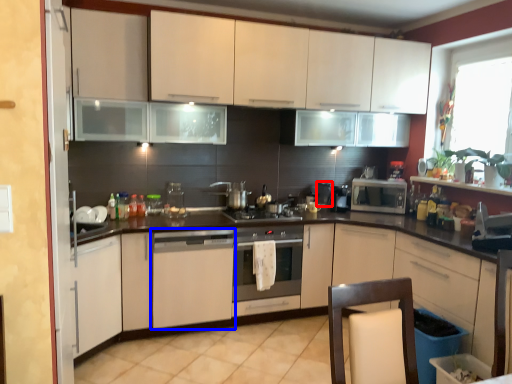
Question: Which of the following is the closest to the observer, appliance (highlighted by a red box) or home appliance (highlighted by a blue box)?

Choices:
 (A) appliance
 (B) home appliance

Answer: (B)